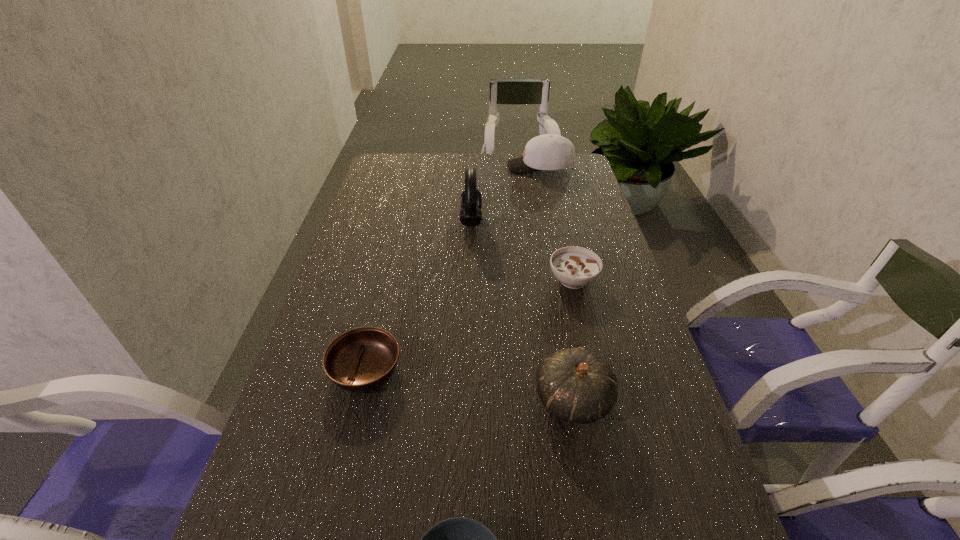
Find the location of `object that is at the far right corner`. object that is at the far right corner is located at coordinates (548, 151).

At what (x,y) coordinates should I click in order to perform the action: click on vacant position at the far edge of the desktop. Please return your answer as a coordinate pair (x, y). Image resolution: width=960 pixels, height=540 pixels. Looking at the image, I should click on (498, 178).

You are a GUI agent. You are given a task and a screenshot of the screen. Output one action in this format:
    pyautogui.click(x=<x>, y=<y>)
    Task: Click on the vacant space at the left edge
    Image resolution: width=960 pixels, height=540 pixels.
    Given the screenshot: What is the action you would take?
    pyautogui.click(x=386, y=229)

In the image, there is a desktop. At what (x,y) coordinates should I click in order to perform the action: click on vacant space at the right edge. Please return your answer as a coordinate pair (x, y). The height and width of the screenshot is (540, 960). Looking at the image, I should click on (633, 306).

Find the location of a particular element. This screenshot has height=540, width=960. vacant area at the far left corner is located at coordinates coord(381,158).

Where is `free spot between the baseball cap and the rightmost soup bowl`? free spot between the baseball cap and the rightmost soup bowl is located at coordinates (557, 224).

Locate an element on the screen. The image size is (960, 540). empty space between the leftmost object and the gourd is located at coordinates (469, 386).

The width and height of the screenshot is (960, 540). Find the location of `vacant space that is in between the baseball cap and the gourd`. vacant space that is in between the baseball cap and the gourd is located at coordinates (557, 284).

The width and height of the screenshot is (960, 540). Identify the location of free space between the leftmost soup bowl and the gourd. (469, 386).

Locate which object is the second closest to the rightmost soup bowl. Please provide its 2D coordinates. Your answer should be formatted as a tuple, i.e. [(x, y)], where the tuple contains the x and y coordinates of a point satisfying the conditions above.

[(575, 385)]